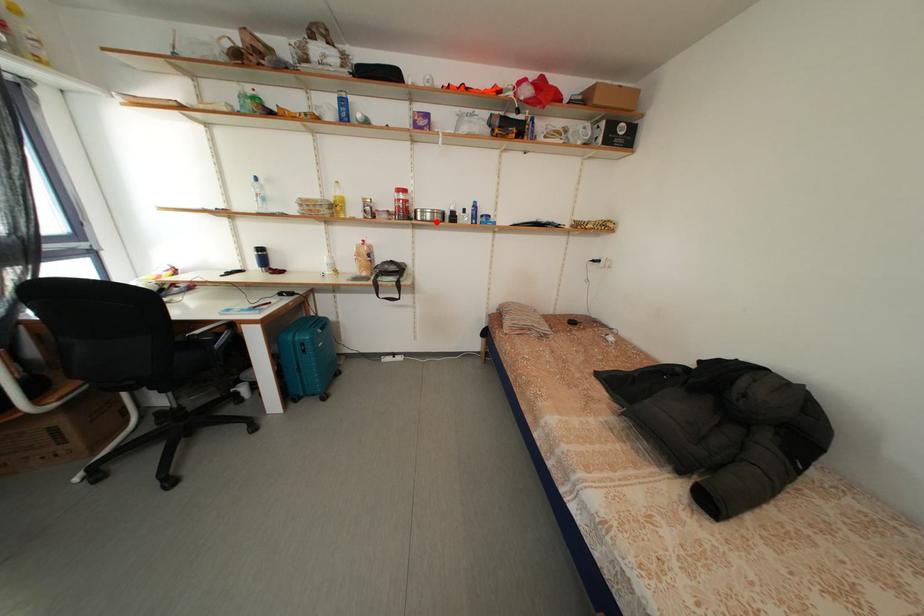
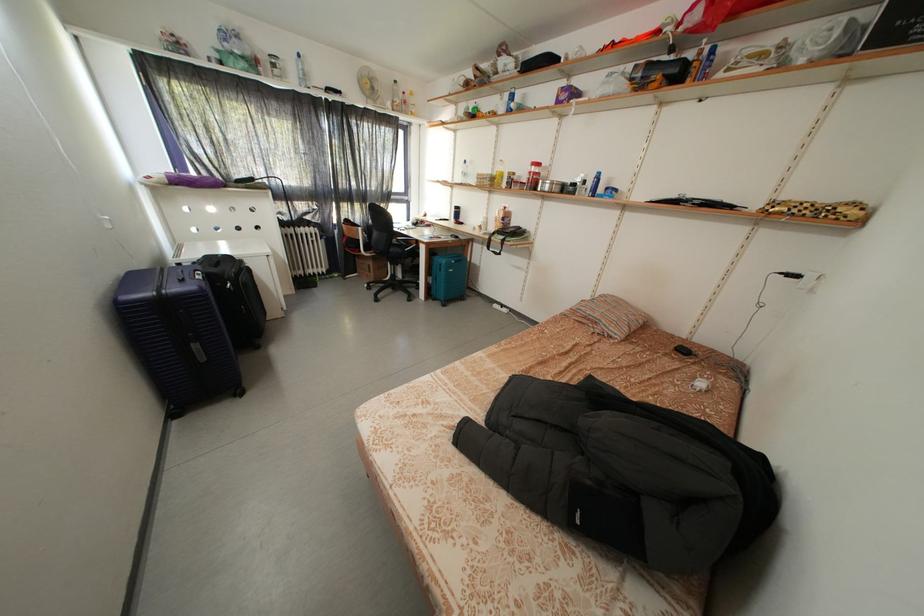
In the second image, find the point that corresponds to the highlighted location in the first image.

(554, 193)